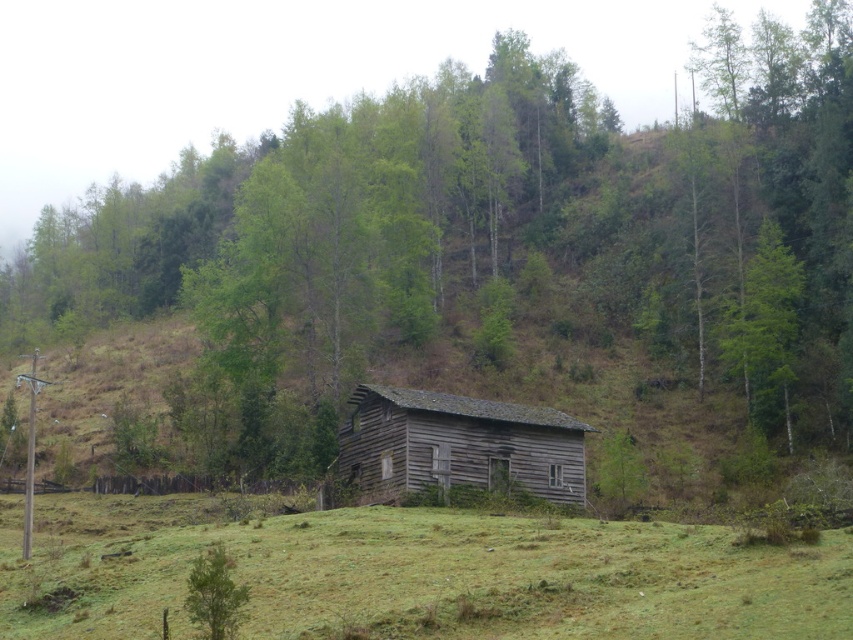
Is green grassy field at lower center positioned behind weathered wood barn at center?

No.

Is green grassy field at lower center smaller than weathered wood barn at center?

No, green grassy field at lower center is not smaller than weathered wood barn at center.

Is point (450, 566) farther from viewer compared to point (575, 502)?

No, it is in front of (575, 502).

Identify the location of green grassy field at lower center. The width and height of the screenshot is (853, 640). (416, 573).